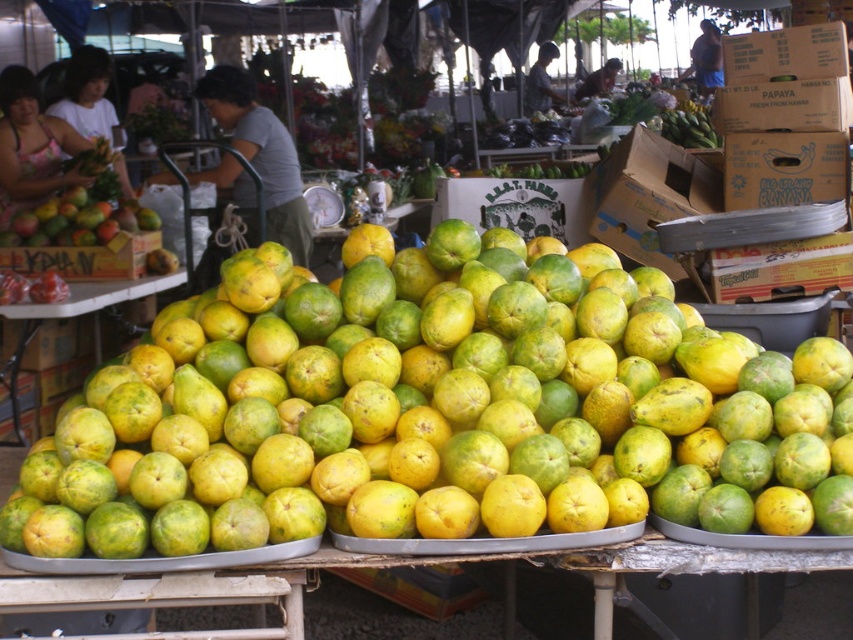
You are standing at the market and want to find the two points mentioned in the scene. If you look at the point labeled point [106,221] and the point labeled point [62,312], which one is closer to you?

Point [62,312] is closer to you because it is in front of point [106,221].

You are a customer at the market and want to place a ripe papaya from the green matte papaya at center into the wooden crate at center. Can you fit the papaya into the crate without moving either item?

The wooden crate at center and green matte papaya at center are 7.29 inches apart. Since the distance between them is greater than the size of the papaya, you would need to move at least one of them closer to ensure the papaya fits into the crate.